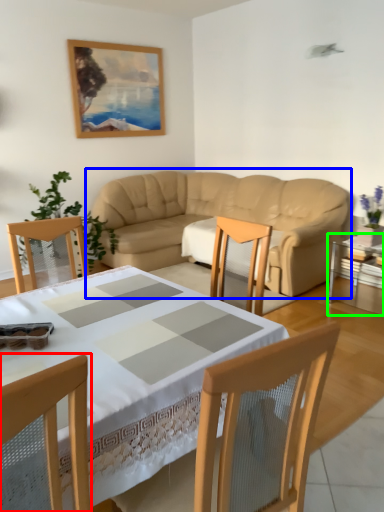
Question: Which object is positioned closest to chair (highlighted by a red box)? Select from studio couch (highlighted by a blue box) and table (highlighted by a green box).

Choices:
 (A) studio couch
 (B) table

Answer: (B)